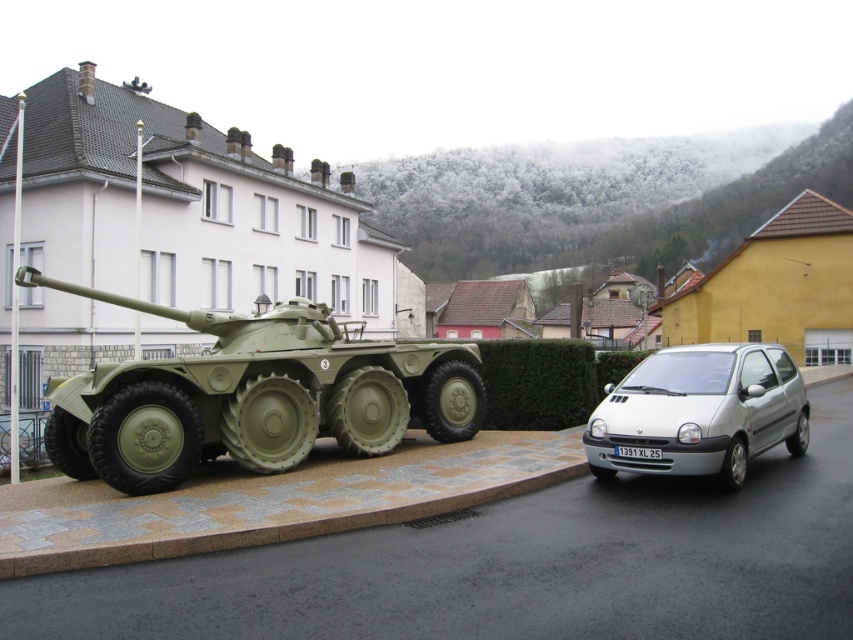
Question: Is matte green tank at center below silver metallic hatchback at right?

Choices:
 (A) yes
 (B) no

Answer: (B)

Question: Among these points, which one is farthest from the camera?

Choices:
 (A) (647, 449)
 (B) (241, 458)

Answer: (B)

Question: Does matte green tank at center appear on the right side of silver metallic hatchback at right?

Choices:
 (A) yes
 (B) no

Answer: (B)

Question: Among these points, which one is nearest to the camera?

Choices:
 (A) (134, 388)
 (B) (799, 436)

Answer: (A)

Question: Can you confirm if silver metallic hatchback at right is positioned to the left of white plastic license plate at center?

Choices:
 (A) yes
 (B) no

Answer: (B)

Question: Which object is farther from the camera taking this photo?

Choices:
 (A) silver metallic hatchback at right
 (B) white plastic license plate at center

Answer: (B)